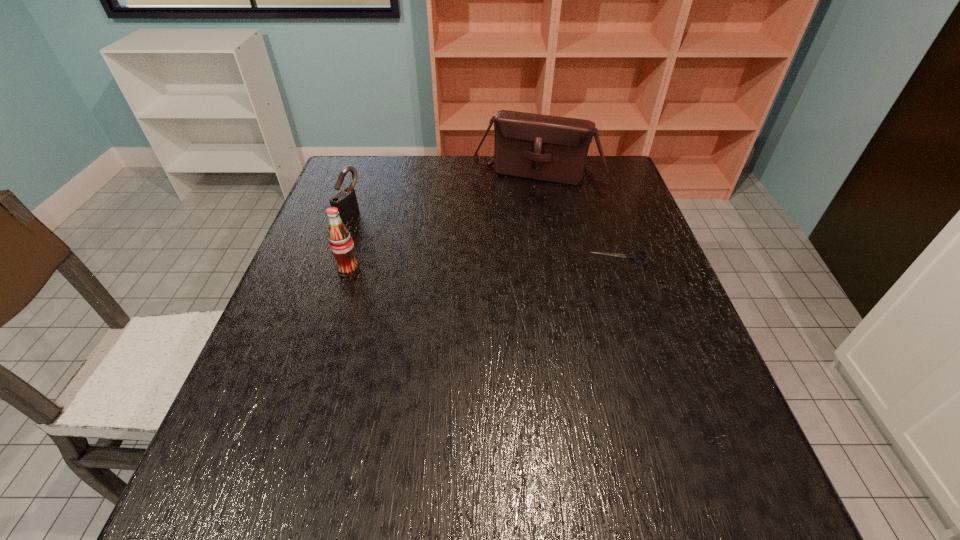
This screenshot has height=540, width=960. In order to click on vacant space on the desktop that is between the soda and the shears and is positioned with the keyhole on the front of the third tallest object in this screenshot , I will do `click(495, 264)`.

The height and width of the screenshot is (540, 960). What are the coordinates of `free spot on the desktop that is between the soda and the shortest object and is positioned on the front flap of the farthest object` in the screenshot? It's located at (510, 263).